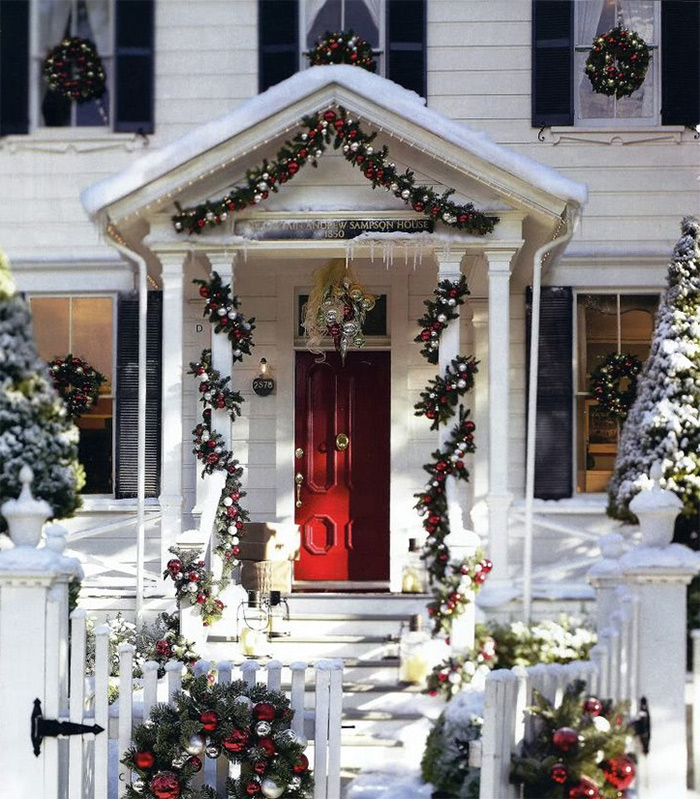
The width and height of the screenshot is (700, 799). Identify the location of basket. (262, 582).